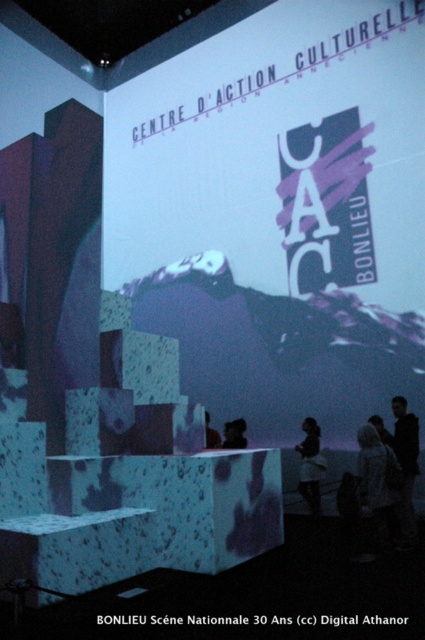
Which is more to the right, white textured coat at lower right or matte black person at center?

white textured coat at lower right

At what (x,y) coordinates should I click in order to perform the action: click on white textured coat at lower right. Please return your answer as a coordinate pair (x, y). Looking at the image, I should click on (379, 483).

The height and width of the screenshot is (640, 425). I want to click on white textured coat at lower right, so click(x=379, y=483).

Is point (334, 400) positioned in front of point (240, 440)?

Yes, it is in front of point (240, 440).

Locate an element on the screen. The width and height of the screenshot is (425, 640). white matte projection screen at center is located at coordinates (278, 212).

Can you confirm if white matte dress at lower center is bigger than dark hair at center?

Yes.

Is white matte dress at lower center to the right of dark hair at center from the viewer's perspective?

Correct, you'll find white matte dress at lower center to the right of dark hair at center.

Find the location of a particular element. The image size is (425, 640). white matte dress at lower center is located at coordinates (311, 465).